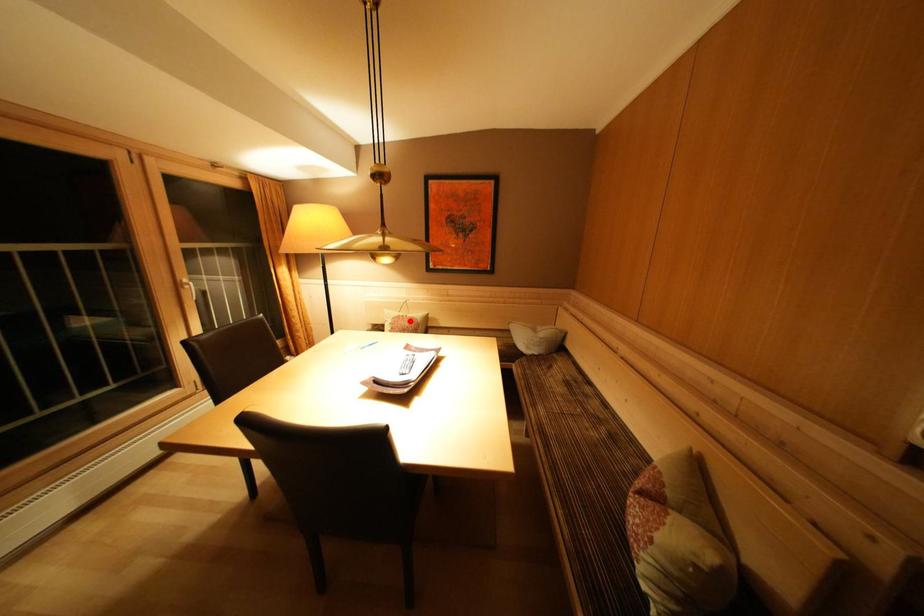
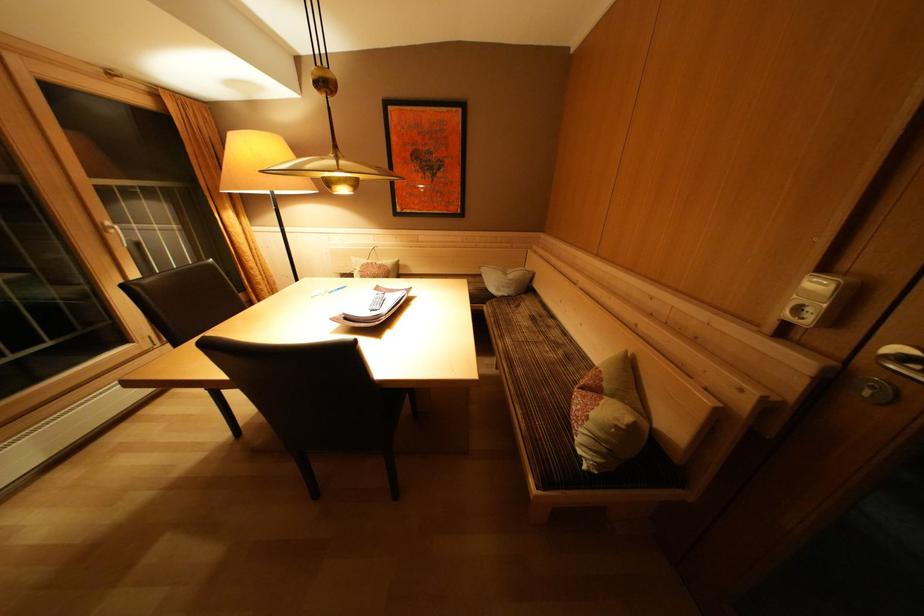
The point at the highlighted location is marked in the first image. Where is the corresponding point in the second image?

(379, 268)